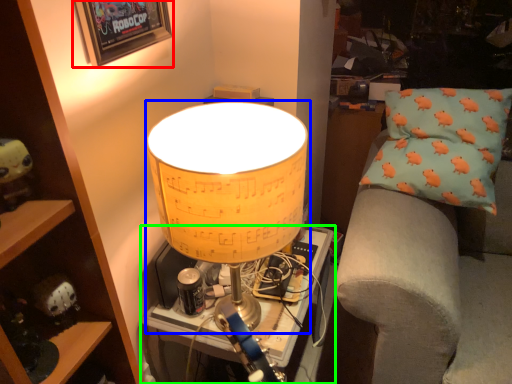
Question: Considering the real-world distances, which object is closest to picture frame (highlighted by a red box)? lamp (highlighted by a blue box) or table (highlighted by a green box).

Choices:
 (A) lamp
 (B) table

Answer: (A)